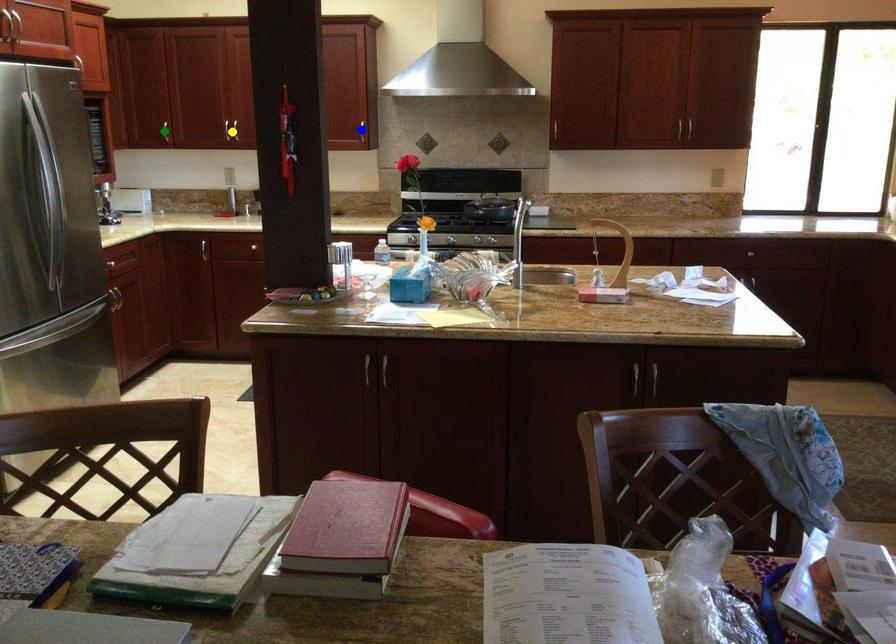
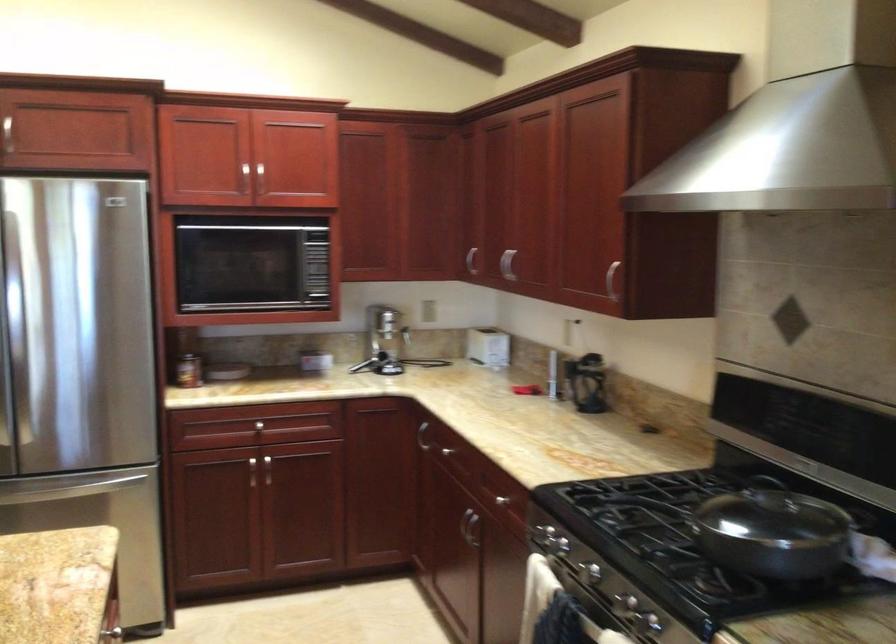
I am providing you with two images of the same scene from different viewpoints. Three points are marked in image1. Which point corresponds to a part or object that is occluded in image2?In image1, three points are marked. Which of them correspond to a part or object that is occluded in image2?Among the three points shown in image1, which one corresponds to a part or object that is no longer visible due to occlusion in image2?

green point, blue point, yellow point cannot be seen in image2.